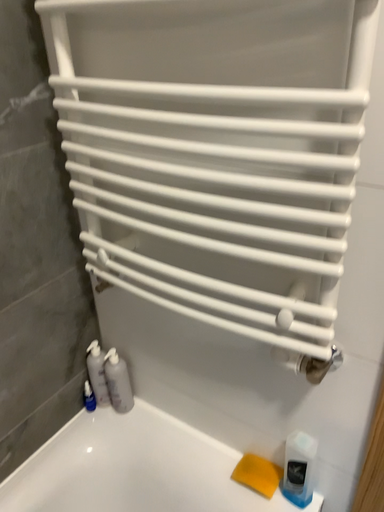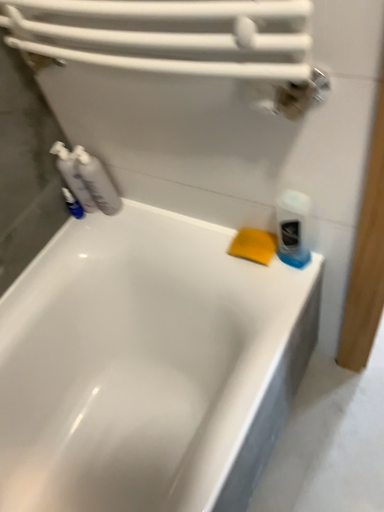
Question: How did the camera likely rotate when shooting the video?

Choices:
 (A) rotated upward
 (B) rotated downward

Answer: (B)